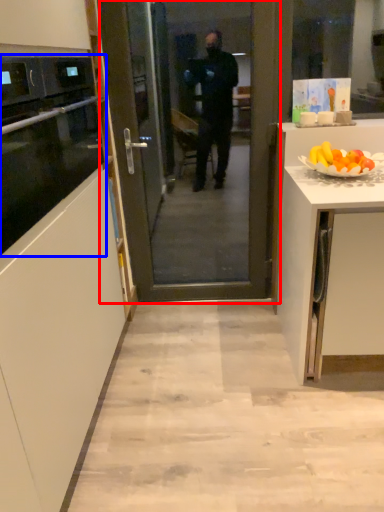
Question: Which point is closer to the camera, screen door (highlighted by a red box) or oven (highlighted by a blue box)?

Choices:
 (A) screen door
 (B) oven

Answer: (B)